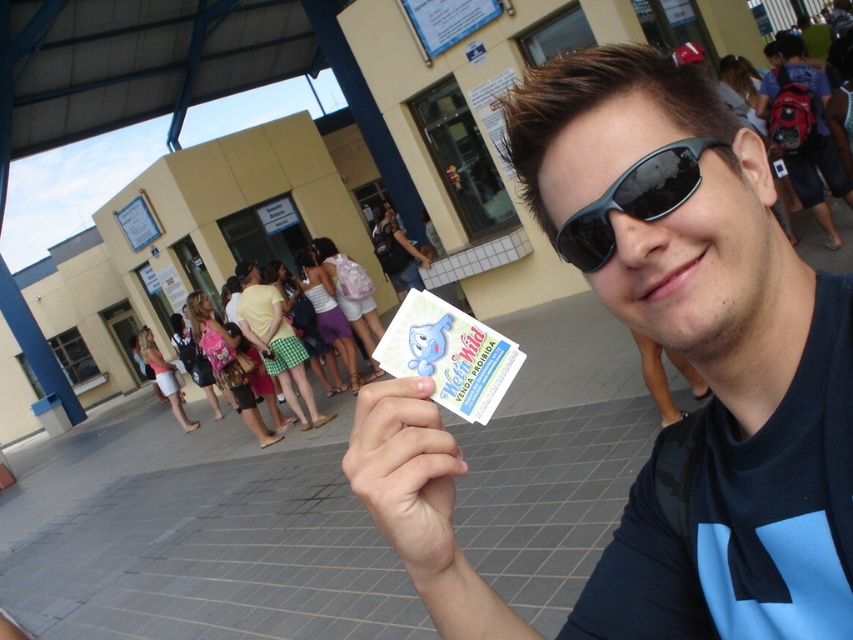
What do you see at coordinates (450, 355) in the screenshot?
I see `white matte card at center` at bounding box center [450, 355].

Is white matte card at center bigger than black matte sunglasses at center?

Indeed, white matte card at center has a larger size compared to black matte sunglasses at center.

Does point (479, 330) lie in front of point (578, 216)?

No, (479, 330) is further to viewer.

Where is `white matte card at center`? The width and height of the screenshot is (853, 640). white matte card at center is located at coordinates (450, 355).

Can you confirm if red backpack at right is wider than black matte sunglasses at center?

Yes, red backpack at right is wider than black matte sunglasses at center.

Does red backpack at right have a larger size compared to black matte sunglasses at center?

Indeed, red backpack at right has a larger size compared to black matte sunglasses at center.

The width and height of the screenshot is (853, 640). I want to click on red backpack at right, so click(x=804, y=132).

Is point (822, 541) less distant than point (656, 156)?

No, (822, 541) is further to viewer.

Which is more to the right, matte black sunglasses at center or black matte sunglasses at center?

Positioned to the right is black matte sunglasses at center.

Describe the element at coordinates (700, 348) in the screenshot. I see `matte black sunglasses at center` at that location.

Where is `matte black sunglasses at center`? This screenshot has height=640, width=853. matte black sunglasses at center is located at coordinates (700, 348).